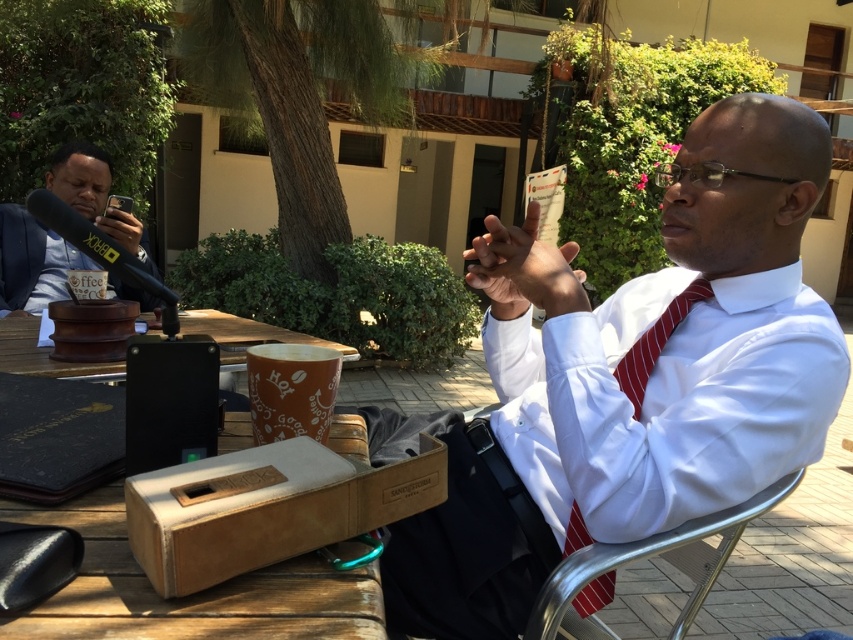
You are organizing a small event and need to place a decorative ribbon around the wooden picnic table at center and the red striped tie at center. Which object requires a longer ribbon to fully encircle it?

The wooden picnic table at center requires a longer ribbon because its width is greater than the red striped tie at center.

You are standing at the origin point of the coordinate system. Where is the wooden picnic table at center located in terms of coordinates?

The wooden picnic table at center is located at coordinates point (190,595).